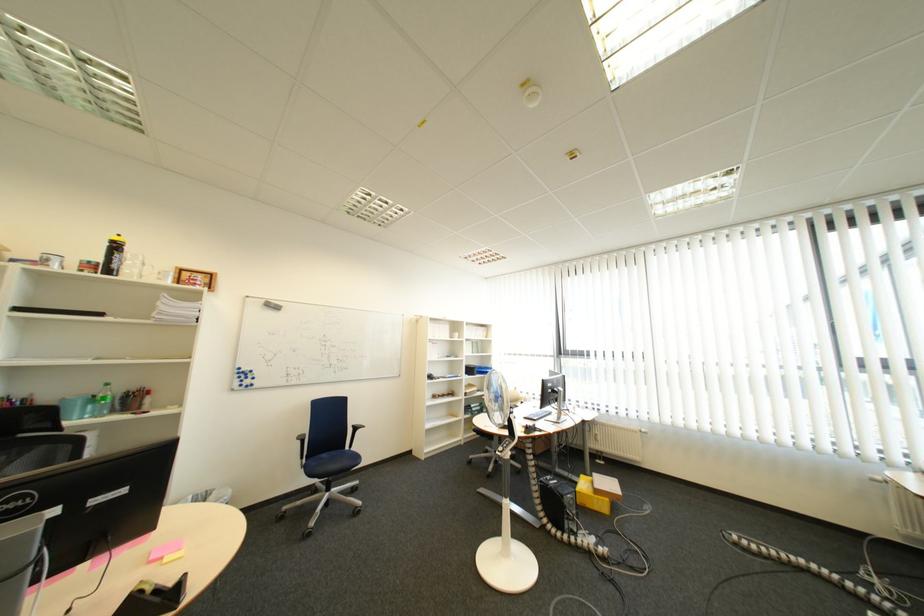
What do you see at coordinates (336, 463) in the screenshot? I see `a blue chair sitting surface` at bounding box center [336, 463].